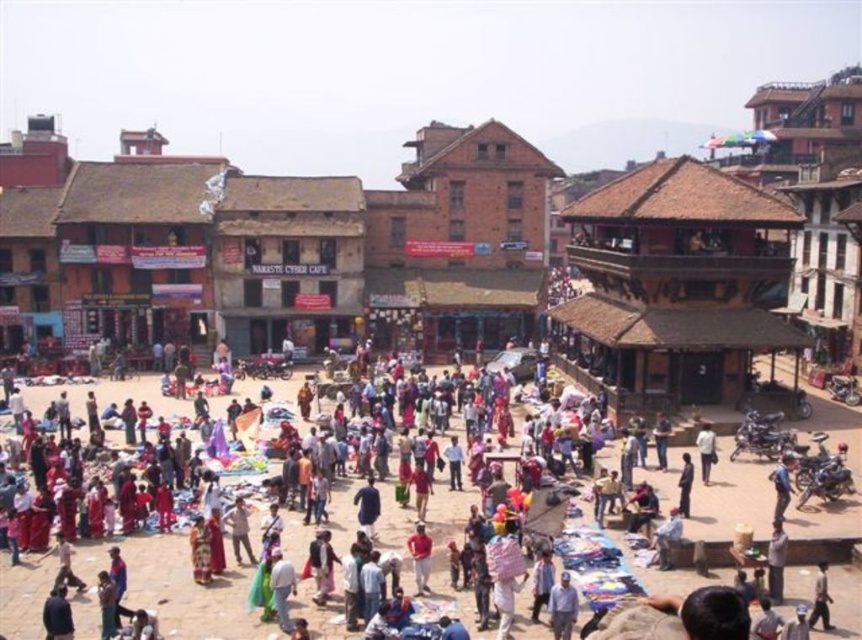
Is brown brick building at center above red fabric person at center?

Yes.

Find the location of a particular element. brown brick building at center is located at coordinates [x=273, y=248].

Find the location of a particular element. This screenshot has height=640, width=862. brown brick building at center is located at coordinates (273, 248).

Can you confirm if red fabric person at center is bigger than light brown fabric shirt at center?

No.

Who is positioned more to the left, red fabric person at center or light brown fabric shirt at center?

red fabric person at center

The image size is (862, 640). In order to click on red fabric person at center in this screenshot , I will do `click(419, 556)`.

Identify the location of red fabric person at center. The image size is (862, 640). (419, 556).

Between matte black motorcycle at center and light brown fabric shirt at center, which one is positioned lower?

Positioned lower is matte black motorcycle at center.

Is matte black motorcycle at center wider than light brown fabric shirt at center?

Correct, the width of matte black motorcycle at center exceeds that of light brown fabric shirt at center.

Is point (211, 611) more distant than point (704, 464)?

No, it is not.

You are a GUI agent. You are given a task and a screenshot of the screen. Output one action in this format:
    pyautogui.click(x=<x>, y=<y>)
    Task: Click on the matte black motorcycle at center
    
    Given the screenshot: What is the action you would take?
    pyautogui.click(x=186, y=589)